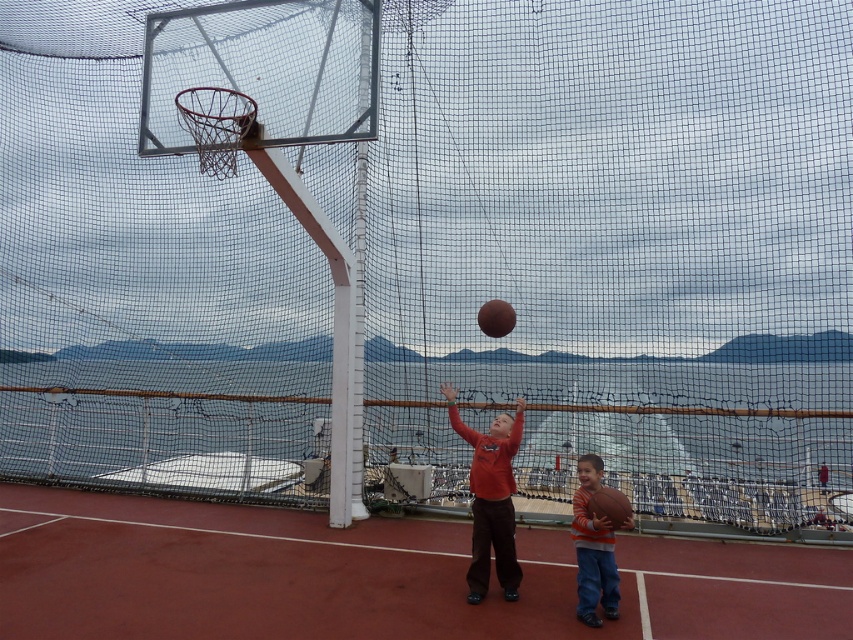
Question: Is metallic silver basketball hoop at upper center wider than glossy brown basketball at center?

Choices:
 (A) yes
 (B) no

Answer: (A)

Question: From the image, what is the correct spatial relationship of matte orange shirt at center in relation to rubber textured basketball at lower right?

Choices:
 (A) below
 (B) above

Answer: (A)

Question: Which object is the farthest from the matte orange shirt at center?

Choices:
 (A) rubberized red basketball court at center
 (B) glossy brown basketball at center

Answer: (A)

Question: Which of the following is the farthest from the observer?

Choices:
 (A) rubberized red basketball court at center
 (B) striped cotton shirt at lower right
 (C) glossy brown basketball at center
 (D) metallic silver basketball hoop at upper center

Answer: (C)

Question: In this image, where is metallic silver basketball hoop at upper center located relative to glossy brown basketball at center?

Choices:
 (A) right
 (B) left

Answer: (B)

Question: Which point is farther to the camera?

Choices:
 (A) rubber textured basketball at lower right
 (B) silver metallic basketball hoop at upper center

Answer: (B)